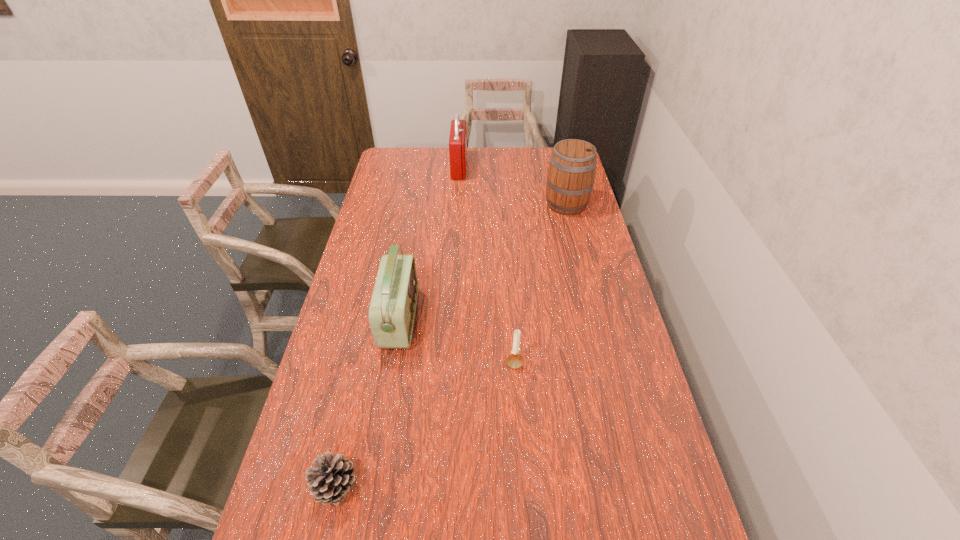
Identify the location of empty space between the third object from left to right and the second object from right to left. The image size is (960, 540). (487, 265).

Where is `free space between the first-aid kit and the rightmost object`? free space between the first-aid kit and the rightmost object is located at coordinates (513, 186).

You are a GUI agent. You are given a task and a screenshot of the screen. Output one action in this format:
    pyautogui.click(x=<x>, y=<y>)
    Task: Click on the free space between the second object from right to left and the rightmost object
    This screenshot has width=960, height=540.
    Given the screenshot: What is the action you would take?
    pyautogui.click(x=540, y=284)

You are a GUI agent. You are given a task and a screenshot of the screen. Output one action in this format:
    pyautogui.click(x=<x>, y=<y>)
    Task: Click on the vacant area that lies between the fourth tallest object and the pinecone
    The width and height of the screenshot is (960, 540).
    Given the screenshot: What is the action you would take?
    pyautogui.click(x=425, y=424)

Find the location of `vacant area that lies between the radio receiver and the nearest object`. vacant area that lies between the radio receiver and the nearest object is located at coordinates (368, 403).

This screenshot has height=540, width=960. In order to click on vacant area that lies between the second object from right to left and the nearest object in this screenshot , I will do `click(425, 424)`.

You are a GUI agent. You are given a task and a screenshot of the screen. Output one action in this format:
    pyautogui.click(x=<x>, y=<y>)
    Task: Click on the vacant area between the shortest object and the radio receiver
    The width and height of the screenshot is (960, 540).
    Given the screenshot: What is the action you would take?
    pyautogui.click(x=368, y=403)

Locate an element on the screen. Image resolution: width=960 pixels, height=540 pixels. the closest object to the rightmost object is located at coordinates (457, 140).

Choose which object is the fourth nearest neighbor to the candle holder. Please provide its 2D coordinates. Your answer should be formatted as a tuple, i.e. [(x, y)], where the tuple contains the x and y coordinates of a point satisfying the conditions above.

[(457, 140)]

At what (x,y) coordinates should I click in order to perform the action: click on free space that satisfies the following two spatial constraints: 1. on the front side of the rightmost object; 2. on the front panel of the radio receiver. Please return your answer as a coordinate pair (x, y). Looking at the image, I should click on (594, 319).